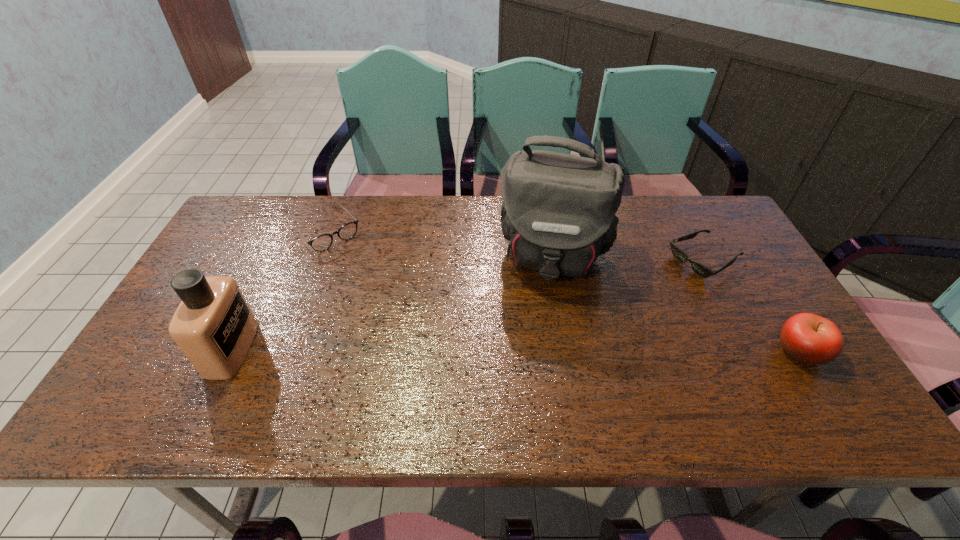
The image size is (960, 540). In order to click on empty location between the sunglasses and the tallest object in this screenshot , I will do `click(630, 259)`.

Choose which object is the nearest neighbor to the third tallest object. Please provide its 2D coordinates. Your answer should be formatted as a tuple, i.e. [(x, y)], where the tuple contains the x and y coordinates of a point satisfying the conditions above.

[(700, 269)]

Image resolution: width=960 pixels, height=540 pixels. In order to click on object identified as the second closest to the second tallest object in this screenshot , I will do `click(558, 214)`.

The height and width of the screenshot is (540, 960). Identify the location of free point that satisfies the following two spatial constraints: 1. on the front side of the third shortest object; 2. on the left side of the shortest object. (753, 352).

The image size is (960, 540). In order to click on vacant area in the image that satisfies the following two spatial constraints: 1. on the front side of the shoulder bag; 2. on the left side of the spectacles in this screenshot , I will do `click(315, 256)`.